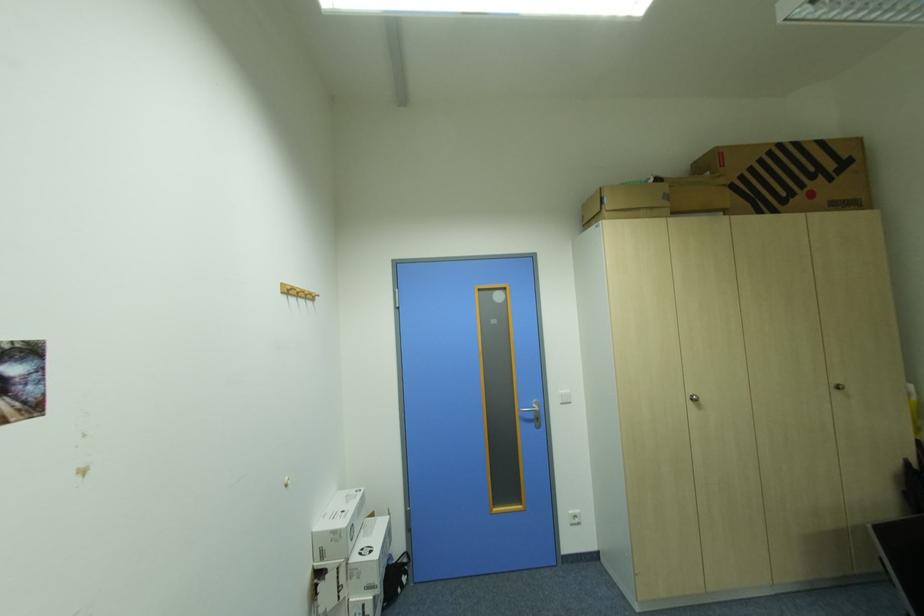
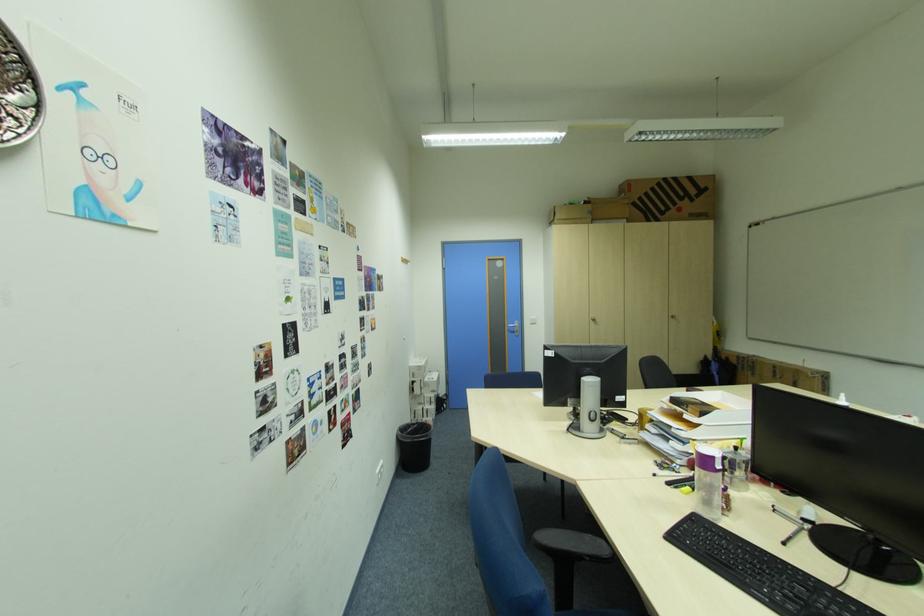
Question: What movement of the cameraman would produce the second image?

Choices:
 (A) Left
 (B) Right
 (C) Forward
 (D) Backward

Answer: (D)